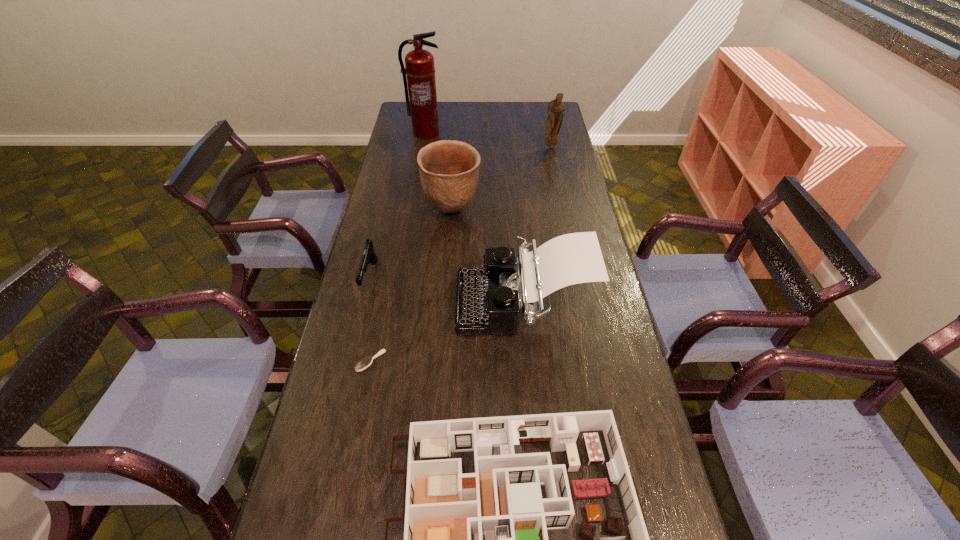
Where is `vacant point located 0.210m on the front of the pottery`? Image resolution: width=960 pixels, height=540 pixels. vacant point located 0.210m on the front of the pottery is located at coordinates (447, 269).

Identify the location of vacant space positioned 0.320m on the keys of the typewriter. The height and width of the screenshot is (540, 960). (353, 302).

The height and width of the screenshot is (540, 960). Identify the location of free space located on the keys of the typewriter. (353, 302).

Find the location of a particular element. This screenshot has width=960, height=540. free location located on the keys of the typewriter is located at coordinates (366, 302).

Image resolution: width=960 pixels, height=540 pixels. Identify the location of vacant position located 0.350m at the aiming end of the gun. (339, 406).

Locate an element on the screen. The width and height of the screenshot is (960, 540). vacant area located on the right of the scrubbing brush is located at coordinates (496, 361).

At what (x,y) coordinates should I click in order to perform the action: click on fire extinguisher at the left edge. Please return your answer as a coordinate pair (x, y). This screenshot has height=540, width=960. Looking at the image, I should click on (420, 70).

The image size is (960, 540). Find the location of `gun present at the left edge`. gun present at the left edge is located at coordinates (369, 256).

The width and height of the screenshot is (960, 540). What are the coordinates of `scrubbing brush that is at the left edge` in the screenshot? It's located at (366, 362).

The height and width of the screenshot is (540, 960). I want to click on figurine located at the right edge, so click(555, 111).